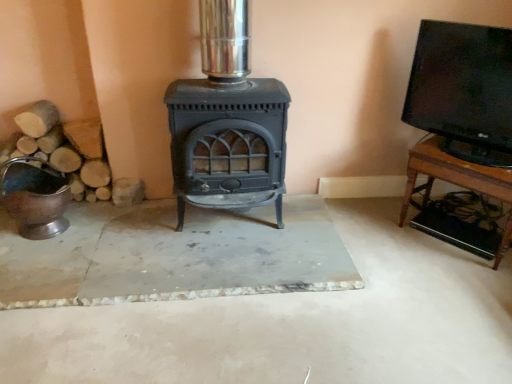
Locate an element on the screen. The width and height of the screenshot is (512, 384). vacant area that lies between matte black wood burning stove at center and shiny metallic bucket at left is located at coordinates (133, 226).